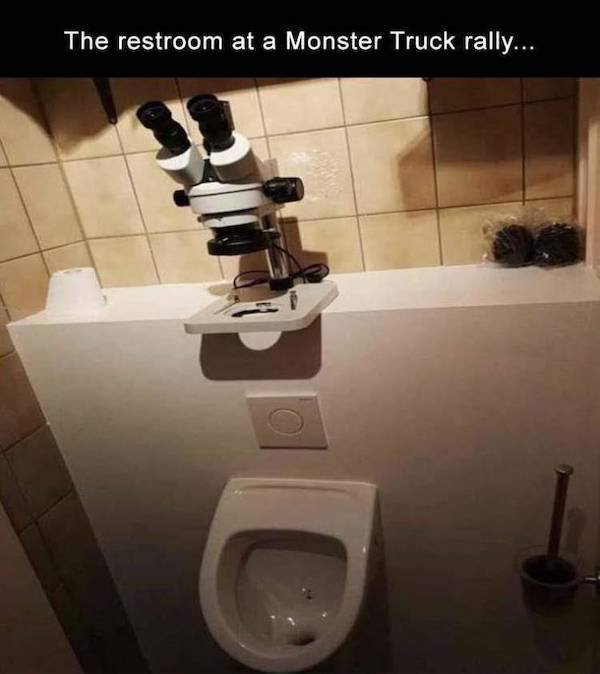
You are a GUI agent. You are given a task and a screenshot of the screen. Output one action in this format:
    pyautogui.click(x=<x>, y=<y>)
    Task: Click on the urinal
    This screenshot has height=674, width=600.
    Given the screenshot: What is the action you would take?
    pyautogui.click(x=338, y=520)